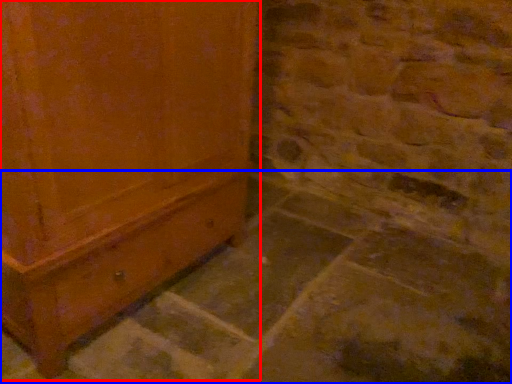
Question: Which point is closer to the camera, furniture (highlighted by a red box) or concrete (highlighted by a blue box)?

Choices:
 (A) furniture
 (B) concrete

Answer: (B)